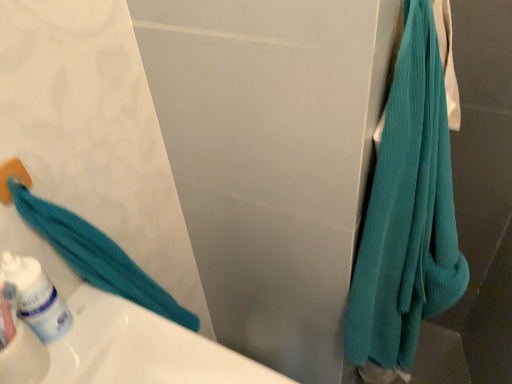
Question: Is teal ribbed towel at right inside the boundaries of white glossy mouthwash at lower left, or outside?

Choices:
 (A) outside
 (B) inside

Answer: (A)

Question: From a real-world perspective, is teal ribbed towel at right above or below white glossy mouthwash at lower left?

Choices:
 (A) below
 (B) above

Answer: (A)

Question: Considering the positions of teal ribbed towel at right and white glossy mouthwash at lower left in the image, is teal ribbed towel at right taller or shorter than white glossy mouthwash at lower left?

Choices:
 (A) short
 (B) tall

Answer: (B)

Question: In the image, is white glossy mouthwash at lower left positioned in front of or behind teal ribbed towel at right?

Choices:
 (A) front
 (B) behind

Answer: (B)

Question: Based on their sizes in the image, would you say white glossy mouthwash at lower left is bigger or smaller than teal ribbed towel at right?

Choices:
 (A) small
 (B) big

Answer: (A)

Question: From the image's perspective, is white glossy mouthwash at lower left above or below teal ribbed towel at right?

Choices:
 (A) above
 (B) below

Answer: (B)

Question: In terms of height, does white glossy mouthwash at lower left look taller or shorter compared to teal ribbed towel at right?

Choices:
 (A) tall
 (B) short

Answer: (B)